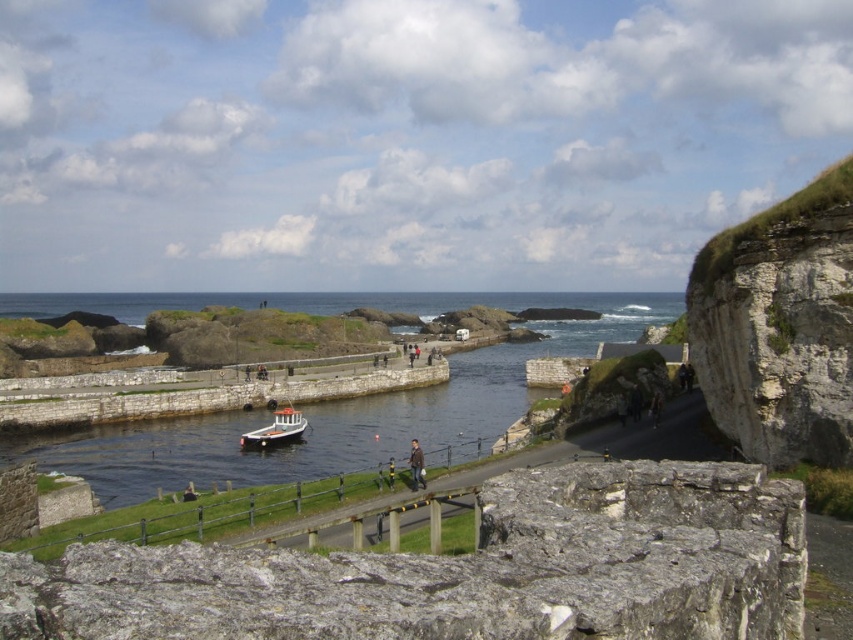
Question: From the image, what is the correct spatial relationship of gray stone cliff at center in relation to gray rocky cliff at right?

Choices:
 (A) left
 (B) right

Answer: (A)

Question: Which of the following is the closest to the observer?

Choices:
 (A) (833, 211)
 (B) (421, 461)
 (C) (364, 609)
 (D) (244, 445)

Answer: (C)

Question: Can you confirm if white wooden boat at center is positioned below brown leather jacket at center?

Choices:
 (A) yes
 (B) no

Answer: (B)

Question: Which point is farther to the camera?

Choices:
 (A) pos(525,616)
 (B) pos(413,461)

Answer: (B)

Question: Can you confirm if white wooden boat at center is positioned to the left of brown leather jacket at center?

Choices:
 (A) no
 (B) yes

Answer: (B)

Question: Which point is farther to the camera?

Choices:
 (A) (254, 448)
 (B) (415, 477)

Answer: (A)